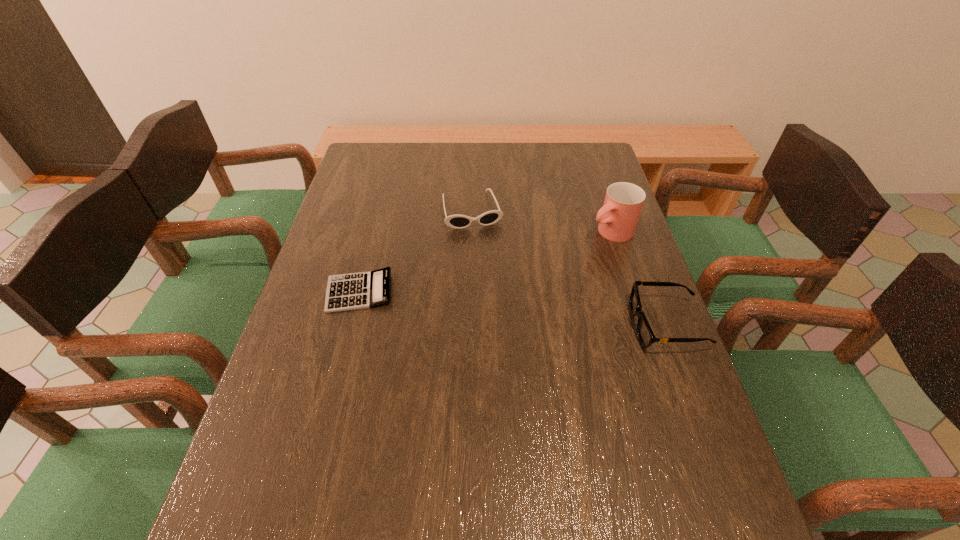
Locate an element on the screen. The image size is (960, 540). blank space located on the side of the cup with the handle is located at coordinates (507, 286).

The height and width of the screenshot is (540, 960). I want to click on free space located on the side of the cup with the handle, so 503,287.

Locate an element on the screen. vacant space positioned on the side of the cup with the handle is located at coordinates (x=576, y=248).

In order to click on vacant space positioned with the lenses of the farther sunglasses facing outward in this screenshot , I will do `click(509, 338)`.

At what (x,y) coordinates should I click in order to perform the action: click on vacant position located with the lenses of the farther sunglasses facing outward. Please return your answer as a coordinate pair (x, y). Looking at the image, I should click on (488, 265).

Find the location of `vacant space located 0.100m with the lenses of the farther sunglasses facing outward`. vacant space located 0.100m with the lenses of the farther sunglasses facing outward is located at coordinates (484, 252).

Locate an element on the screen. object positioned at the left edge is located at coordinates (363, 290).

I want to click on sunglasses at the right edge, so click(645, 334).

Identify the location of cup positioned at the right edge. This screenshot has height=540, width=960. (618, 217).

Identify the location of vacant space at the far edge. (517, 154).